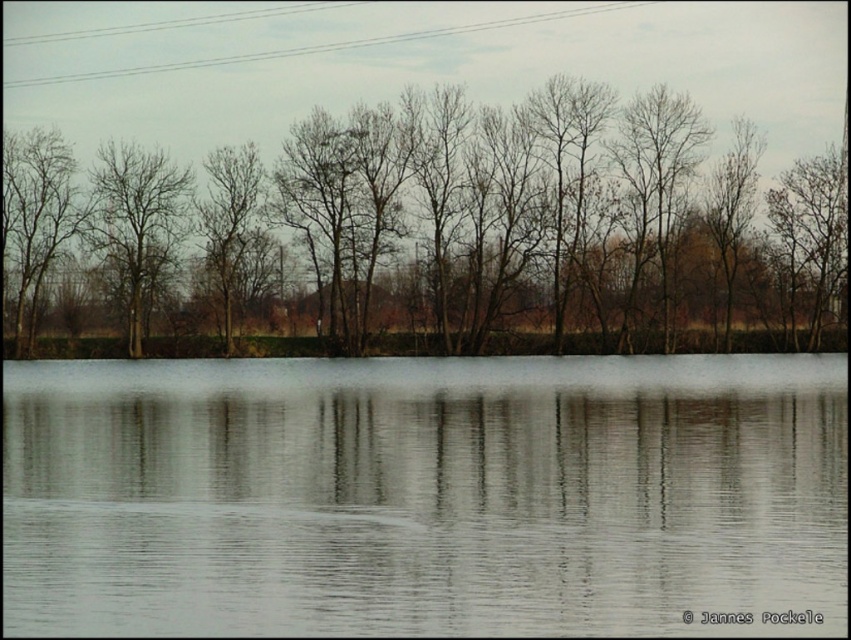
Can you confirm if transparent water at center is positioned to the right of bare branches at center?

Indeed, transparent water at center is positioned on the right side of bare branches at center.

Who is more distant from viewer, (x=420, y=588) or (x=198, y=330)?

Positioned behind is point (x=198, y=330).

At what (x,y) coordinates should I click in order to perform the action: click on transparent water at center. Please return your answer as a coordinate pair (x, y). Image resolution: width=851 pixels, height=640 pixels. Looking at the image, I should click on (421, 493).

From the picture: Is transparent water at center wider than bare branches at left?

Yes, transparent water at center is wider than bare branches at left.

Can you confirm if transparent water at center is bigger than bare branches at left?

Yes.

This screenshot has height=640, width=851. What are the coordinates of `transparent water at center` in the screenshot? It's located at (421, 493).

Is point (403, 273) closer to viewer compared to point (116, 180)?

That is True.

What do you see at coordinates (432, 236) in the screenshot?
I see `bare branches at center` at bounding box center [432, 236].

Between point (766, 330) and point (174, 180), which one is positioned in front?

Point (766, 330) is more forward.

This screenshot has height=640, width=851. I want to click on bare branches at center, so click(432, 236).